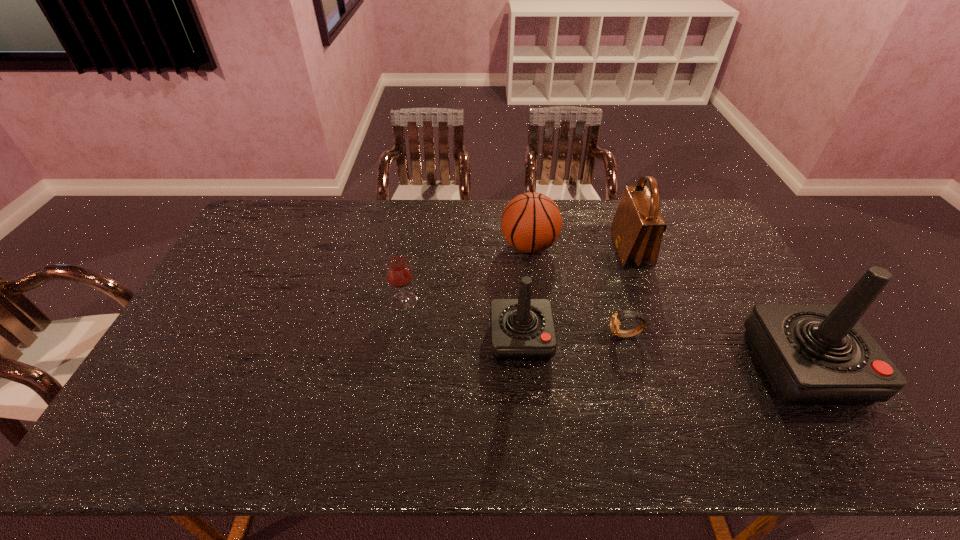
In the image, there is a desktop. Identify the location of free space at the far left corner. This screenshot has height=540, width=960. (283, 202).

The image size is (960, 540). In the image, there is a desktop. Find the location of `vacant space at the near left corner`. vacant space at the near left corner is located at coordinates (150, 391).

This screenshot has width=960, height=540. In the image, there is a desktop. Find the location of `free space at the far right corner`. free space at the far right corner is located at coordinates (697, 220).

The image size is (960, 540). Find the location of `free space between the right joystick and the fifth shortest object`. free space between the right joystick and the fifth shortest object is located at coordinates (717, 308).

Identify the location of empty location between the shortest object and the second tallest object. The height and width of the screenshot is (540, 960). (628, 292).

Image resolution: width=960 pixels, height=540 pixels. In order to click on vacant area that lies between the rightmost object and the watch in this screenshot , I will do `click(714, 351)`.

At what (x,y) coordinates should I click in order to perform the action: click on vacant area between the tallest object and the second object from right to left. Please return your answer as a coordinate pair (x, y). This screenshot has height=540, width=960. Looking at the image, I should click on (717, 308).

This screenshot has width=960, height=540. I want to click on free spot between the shorter joystick and the wineglass, so click(463, 320).

Locate an element on the screen. Image resolution: width=960 pixels, height=540 pixels. vacant space that is in between the third object from right to left and the tallest object is located at coordinates (714, 351).

Find the location of a particular element. This screenshot has width=960, height=540. vacant region between the wineglass and the second object from right to left is located at coordinates (517, 275).